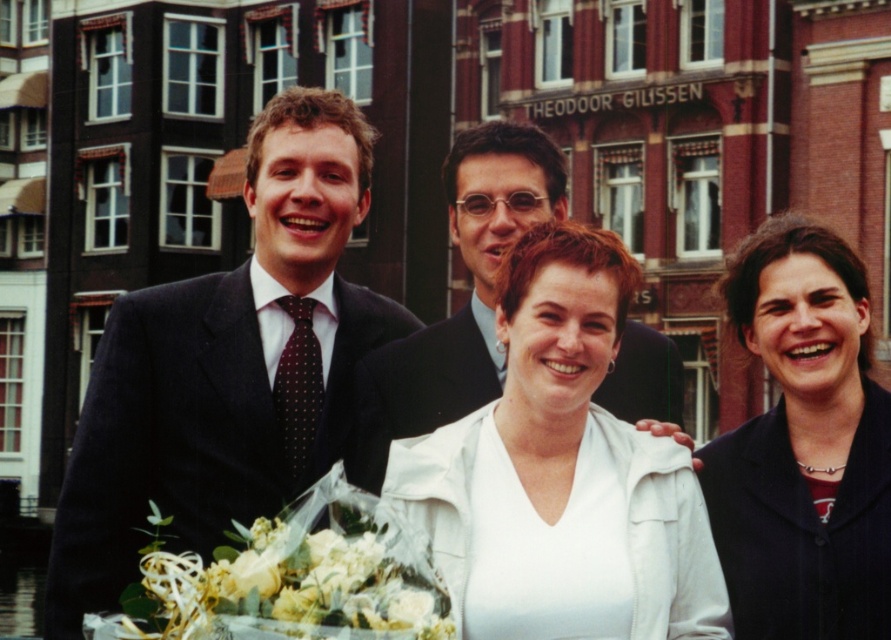
Please look at the scene described. There is a point labeled as point [562,474] in the image. What object is located at this point?

The point [562,474] marks the white matte jacket at center.

You are standing in front of the building named Theodoor Gilissen and want to find the person wearing the dark suit at center. According to the coordinates provided, where should you look relative to the building?

The dark suit at center is located at point (226, 368), which means it is positioned slightly to the right and a bit below the center of the image. Since the building is in the background, you should look towards the right side and lower middle area near the building facade to find the person in the dark suit at center.